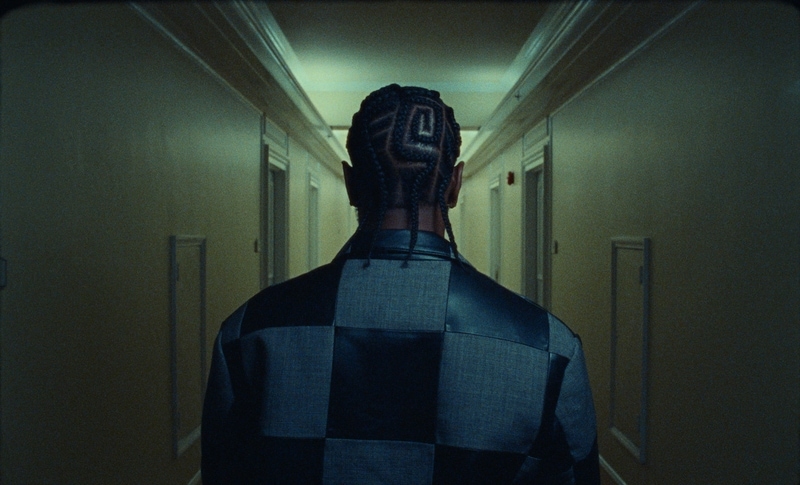
The image size is (800, 485). Find the location of `ceiling`. ceiling is located at coordinates (396, 49).